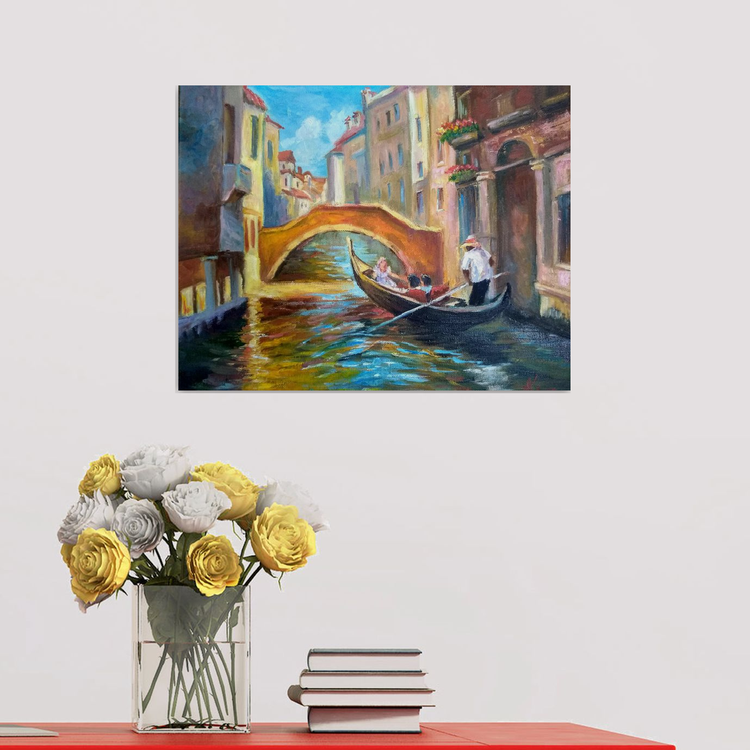
Image resolution: width=750 pixels, height=750 pixels. I want to click on painting, so click(x=424, y=195).